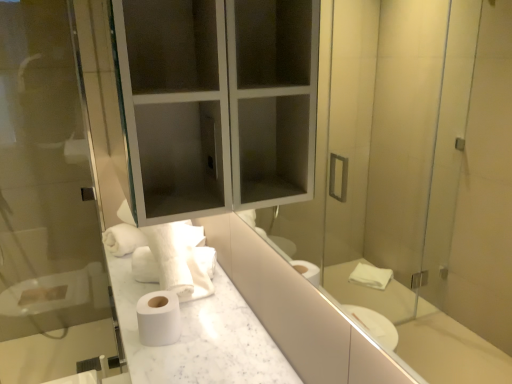
Question: From a real-world perspective, is matte glass medicine cabinet at upper center physically below white matte toilet paper at center?

Choices:
 (A) no
 (B) yes

Answer: (A)

Question: Can you confirm if matte glass medicine cabinet at upper center is wider than white matte toilet paper at center?

Choices:
 (A) yes
 (B) no

Answer: (A)

Question: Is matte glass medicine cabinet at upper center turned away from white matte toilet paper at center?

Choices:
 (A) yes
 (B) no

Answer: (B)

Question: Is matte glass medicine cabinet at upper center outside white matte toilet paper at center?

Choices:
 (A) no
 (B) yes

Answer: (B)

Question: Is matte glass medicine cabinet at upper center positioned in front of white matte toilet paper at center?

Choices:
 (A) yes
 (B) no

Answer: (A)

Question: Does matte glass medicine cabinet at upper center turn towards white matte toilet paper at center?

Choices:
 (A) yes
 (B) no

Answer: (B)

Question: From the image's perspective, is white matte toilet paper at center on transparent glass screen door at left?

Choices:
 (A) no
 (B) yes

Answer: (A)

Question: Is white matte toilet paper at center bigger than transparent glass screen door at left?

Choices:
 (A) no
 (B) yes

Answer: (A)

Question: Can you confirm if white matte toilet paper at center is wider than transparent glass screen door at left?

Choices:
 (A) yes
 (B) no

Answer: (A)

Question: Can you confirm if white matte toilet paper at center is thinner than transparent glass screen door at left?

Choices:
 (A) no
 (B) yes

Answer: (A)

Question: Can transparent glass screen door at left be found inside white matte toilet paper at center?

Choices:
 (A) yes
 (B) no

Answer: (B)

Question: Does white matte toilet paper at center have a smaller size compared to transparent glass screen door at left?

Choices:
 (A) no
 (B) yes

Answer: (B)

Question: Could you tell me if white marble countertop at center is turned towards transparent glass screen door at left?

Choices:
 (A) no
 (B) yes

Answer: (A)